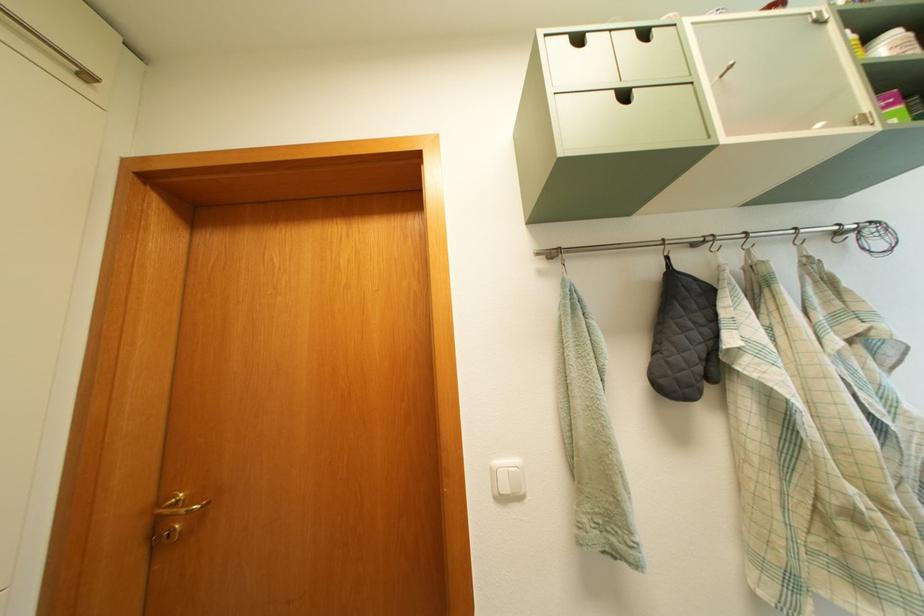
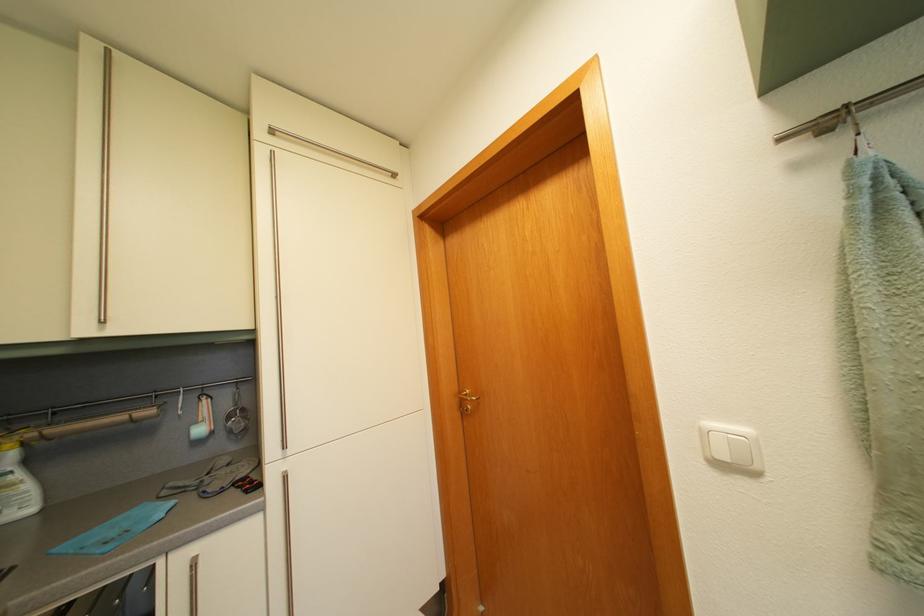
Question: The images are taken continuously from a first-person perspective. In which direction is your viewpoint rotating?

Choices:
 (A) Left
 (B) Right
 (C) Up
 (D) Down

Answer: (A)